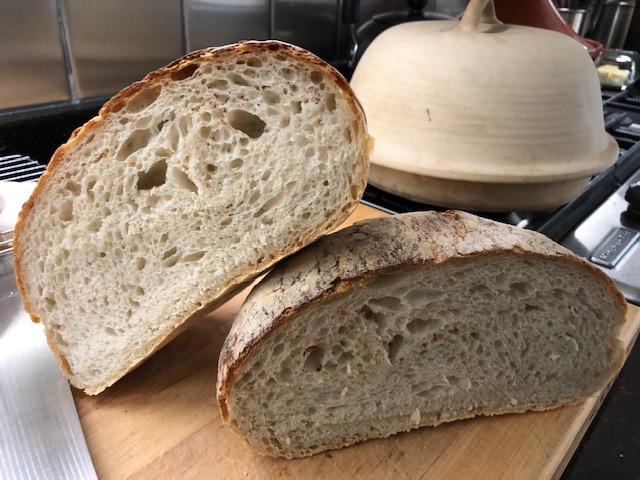
Where is `handle`? The image size is (640, 480). handle is located at coordinates (477, 9).